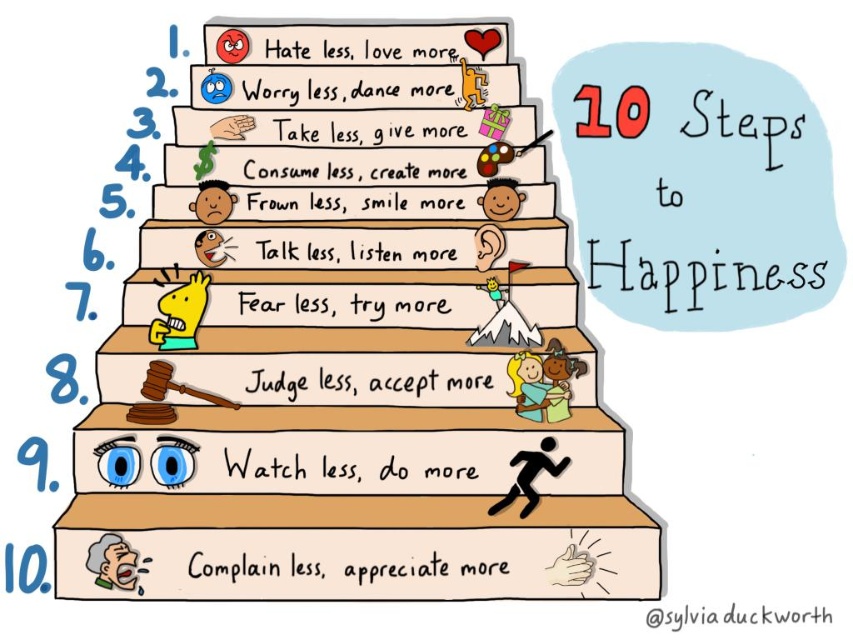
Which is in front, point (544, 442) or point (496, 182)?

Point (544, 442) is more forward.

Can you confirm if black figure at bottom is taller than smooth skin face at center?

Indeed, black figure at bottom has a greater height compared to smooth skin face at center.

Which is behind, point (511, 502) or point (502, 200)?

Point (502, 200)

Where is `black figure at bottom`? The image size is (853, 640). black figure at bottom is located at coordinates (531, 476).

Is point (117, 570) behind point (532, 369)?

No, (117, 570) is in front of (532, 369).

Is point (99, 576) closer to camera compared to point (537, 364)?

Yes, point (99, 576) is in front of point (537, 364).

Which is in front, point (138, 586) or point (520, 358)?

Point (138, 586)

You are a GUI agent. You are given a task and a screenshot of the screen. Output one action in this format:
    pyautogui.click(x=<x>, y=<y>)
    Task: Click on the gray paper at bottom
    
    Given the screenshot: What is the action you would take?
    pyautogui.click(x=114, y=563)

Who is higher up, golden statue at upper center or smooth skin face at center?

Positioned higher is smooth skin face at center.

In the scene shown: Does golden statue at upper center appear on the right side of smooth skin face at center?

Yes, golden statue at upper center is to the right of smooth skin face at center.

Which is behind, point (515, 380) or point (508, 186)?

Point (508, 186)

This screenshot has height=640, width=853. What are the coordinates of `golden statue at upper center` in the screenshot? It's located at (527, 385).